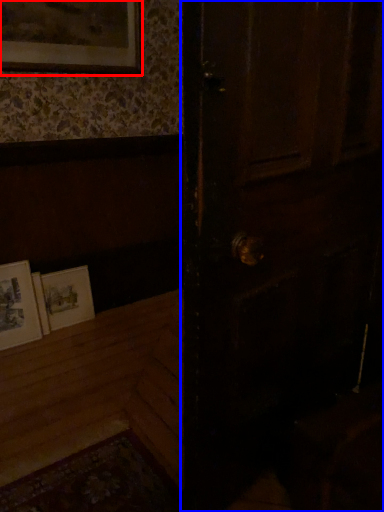
Question: Which object is closer to the camera taking this photo, picture frame (highlighted by a red box) or door (highlighted by a blue box)?

Choices:
 (A) picture frame
 (B) door

Answer: (B)